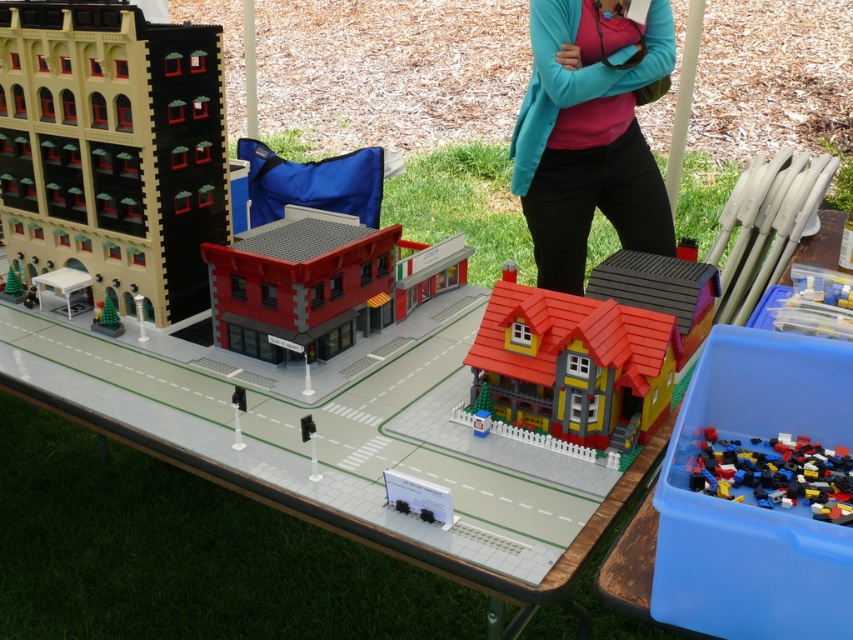
You are a visitor looking at the LEGO city setup on the table. You notice the smooth red roof at center and the white plastic table at lower left. Which object is positioned more to the east in the scene?

The smooth red roof at center is positioned more to the east than the white plastic table at lower left because it is to the right of it.

You are setting up a new display for a LEGO exhibition. You have a smooth red roof at center and a white plastic table at lower left. The exhibition requires that the table must be wider than the roof. Based on the scene, will the current setup meet this requirement?

The smooth red roof at center is wider than the white plastic table at lower left, so the current setup does not meet the requirement that the table must be wider than the roof.